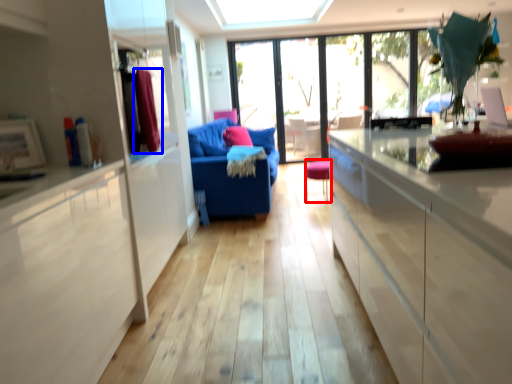
Question: Which object is closer to the camera taking this photo, chair (highlighted by a red box) or curtain (highlighted by a blue box)?

Choices:
 (A) chair
 (B) curtain

Answer: (B)